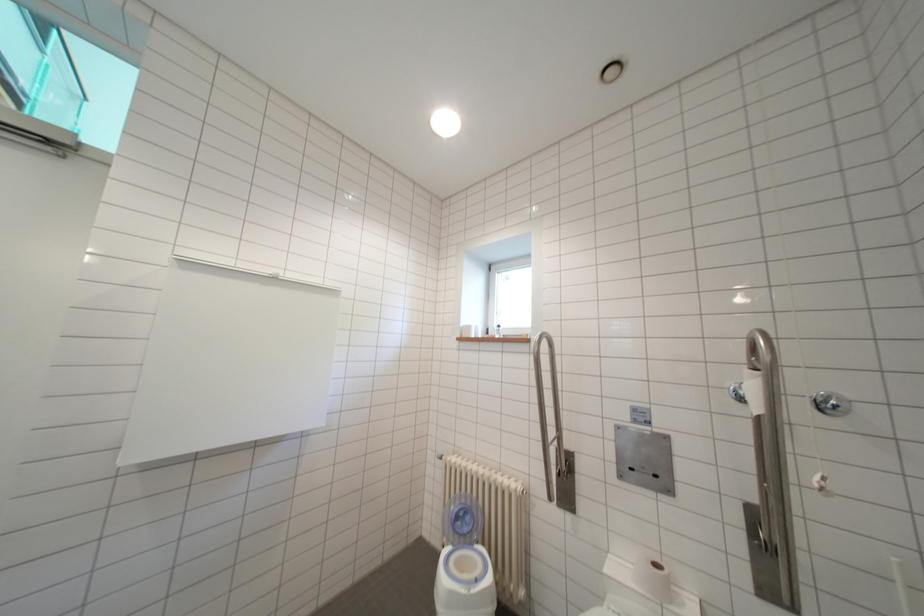
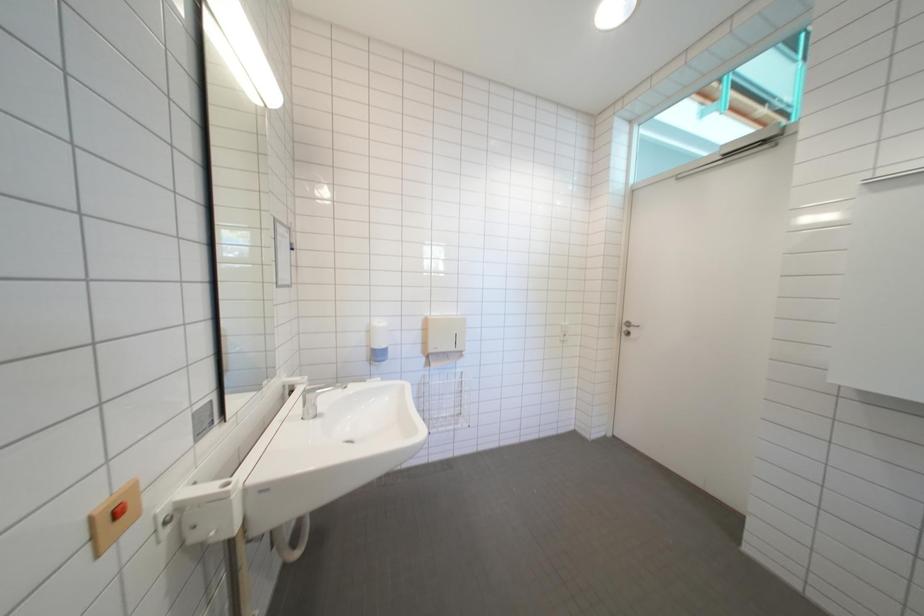
Question: The camera is either moving clockwise (left) or counter-clockwise (right) around the object. The first image is from the beginning of the video and the second image is from the end. Is the camera moving left or right when shooting the video?

Choices:
 (A) Left
 (B) Right

Answer: (B)